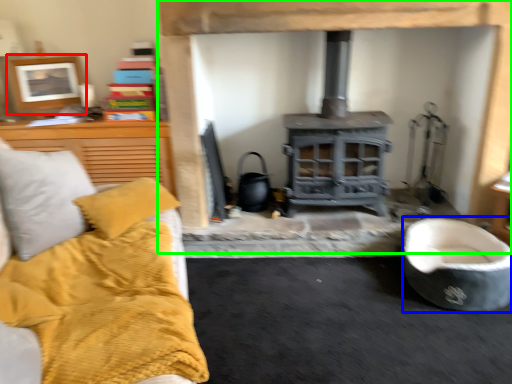
Question: Based on their relative distances, which object is farther from picture frame (highlighted by a red box)? Choose from rocking chair (highlighted by a blue box) and fireplace (highlighted by a green box).

Choices:
 (A) rocking chair
 (B) fireplace

Answer: (A)